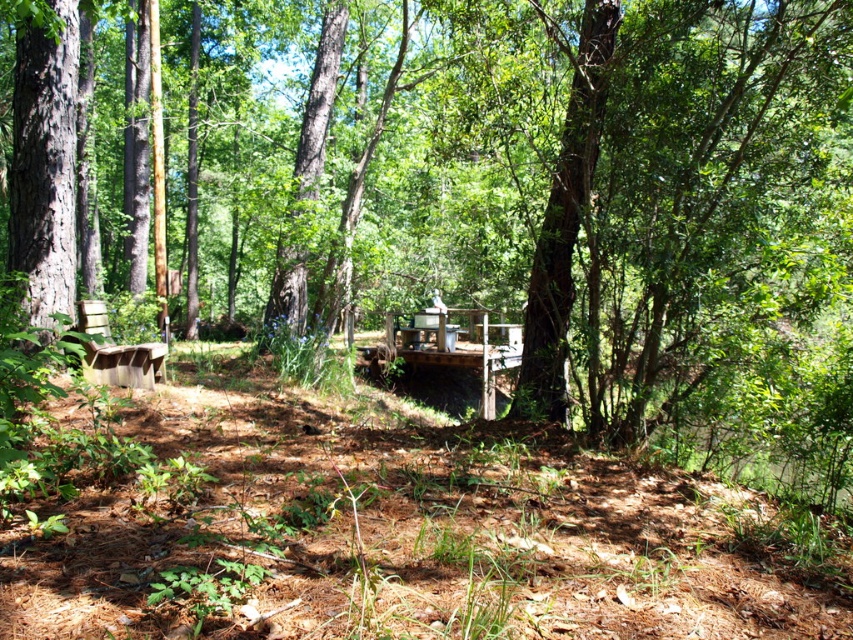
Looking at this image, you are planning to set up a picnic and have a choice between the wooden picnic table at center and the wooden park bench at left. If you want to sit closer to the trees, which option should you choose?

The wooden park bench at left is to the left of the wooden picnic table at center, so sitting there would place you closer to the trees if they are positioned to the left side of the scene.

You are planning to host a small gathering in the forest area shown. You need to seat 4 people. Which object, the wooden picnic table at center or the wooden park bench at left, would be more suitable for seating all 4 comfortably?

The wooden picnic table at center is larger in size compared to the wooden park bench at left, making it more suitable for seating 4 people comfortably.

You are planning to set up a tent for a camping trip and need to choose between the wooden picnic table at center and the wooden park bench at left. Which object is positioned higher and would provide a better vantage point to watch the sunset?

The wooden picnic table at center is above the wooden park bench at left, so it would provide a better vantage point for watching the sunset.